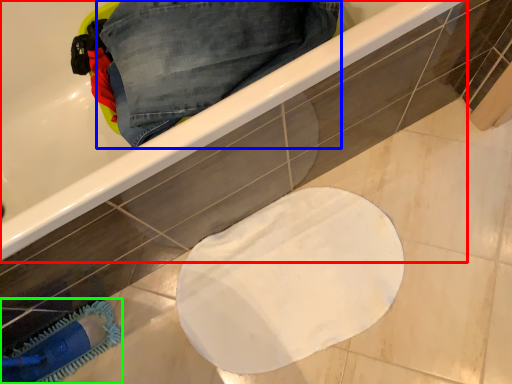
Question: Considering the real-world distances, which object is closest to bathtub (highlighted by a red box)? trousers (highlighted by a blue box) or brush (highlighted by a green box).

Choices:
 (A) trousers
 (B) brush

Answer: (A)